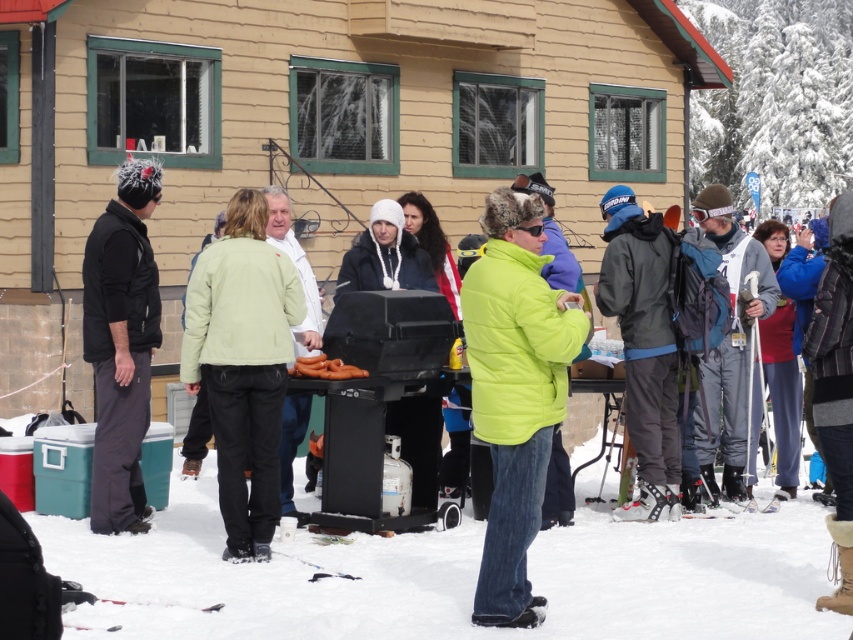
Question: Which is nearer to the white fluffy snow at lower center?

Choices:
 (A) brown matte hot dogs at center
 (B) black fleece jacket at left
 (C) light green fabric jacket at center

Answer: (A)

Question: Does white fluffy snow at lower center have a lesser width compared to brown matte hot dogs at center?

Choices:
 (A) yes
 (B) no

Answer: (A)

Question: Which is nearer to the brown matte hot dogs at center?

Choices:
 (A) white fluffy snow at lower center
 (B) light green fabric jacket at center

Answer: (B)

Question: Among these objects, which one is nearest to the camera?

Choices:
 (A) black fleece jacket at left
 (B) green puffy jacket at center

Answer: (B)

Question: Is green puffy jacket at center below brown matte hot dogs at center?

Choices:
 (A) no
 (B) yes

Answer: (B)

Question: Can you confirm if light green fabric jacket at center is positioned below black fleece jacket at left?

Choices:
 (A) yes
 (B) no

Answer: (A)